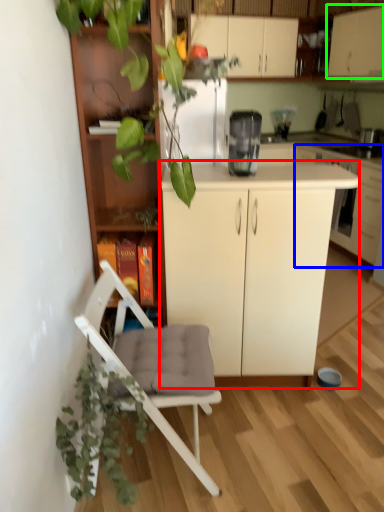
Question: Which object is the closest to the cabinetry (highlighted by a red box)? Choose among these: cabinetry (highlighted by a blue box) or cabinetry (highlighted by a green box).

Choices:
 (A) cabinetry
 (B) cabinetry

Answer: (A)